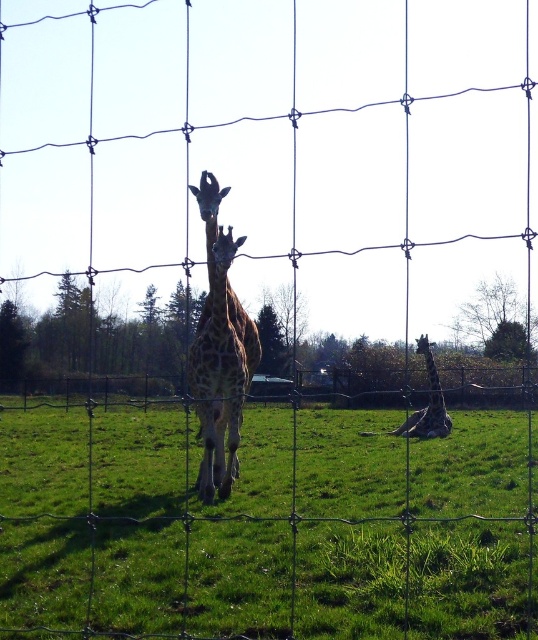
Question: Is the position of green grass at center less distant than that of spotted fur giraffe at center?

Choices:
 (A) no
 (B) yes

Answer: (B)

Question: Can you confirm if green grass at center is bigger than spotted fur giraffe at lower right?

Choices:
 (A) no
 (B) yes

Answer: (B)

Question: Estimate the real-world distances between objects in this image. Which object is farther from the green grass at center?

Choices:
 (A) spotted fur giraffe at lower right
 (B) spotted fur giraffe at center

Answer: (A)

Question: Which object is farther from the camera taking this photo?

Choices:
 (A) spotted fur giraffe at lower right
 (B) spotted fur giraffe at center

Answer: (A)

Question: Which object is the farthest from the green grass at center?

Choices:
 (A) spotted fur giraffe at lower right
 (B) spotted fur giraffe at center

Answer: (A)

Question: Does spotted fur giraffe at center appear under spotted fur giraffe at lower right?

Choices:
 (A) no
 (B) yes

Answer: (A)